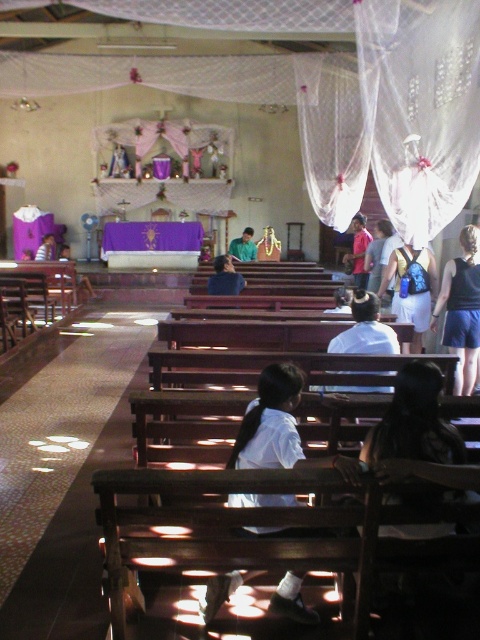
Is white fabric backpack at center closer to camera compared to green matte shirt at center?

Yes, white fabric backpack at center is in front of green matte shirt at center.

Does white fabric backpack at center have a lesser width compared to green matte shirt at center?

No, white fabric backpack at center is not thinner than green matte shirt at center.

Is point (434, 289) positioned in front of point (236, 248)?

Yes, it is.

Where is `white fabric backpack at center`? white fabric backpack at center is located at coordinates (411, 289).

Is green matte shirt at center wider than matte black laptop at left?

Yes.

Which is below, green matte shirt at center or matte black laptop at left?

green matte shirt at center is below.

Between point (252, 243) and point (40, 253), which one is positioned behind?

Point (40, 253)

This screenshot has height=640, width=480. Find the location of `green matte shirt at center`. green matte shirt at center is located at coordinates (243, 246).

Between blue denim shorts at lower right and white fabric backpack at center, which one appears on the left side from the viewer's perspective?

From the viewer's perspective, white fabric backpack at center appears more on the left side.

In the scene shown: Can you confirm if blue denim shorts at lower right is positioned to the right of white fabric backpack at center?

Indeed, blue denim shorts at lower right is positioned on the right side of white fabric backpack at center.

The image size is (480, 640). Find the location of `blue denim shorts at lower right`. blue denim shorts at lower right is located at coordinates (462, 308).

The width and height of the screenshot is (480, 640). Find the location of `blue denim shorts at lower right`. blue denim shorts at lower right is located at coordinates (462, 308).